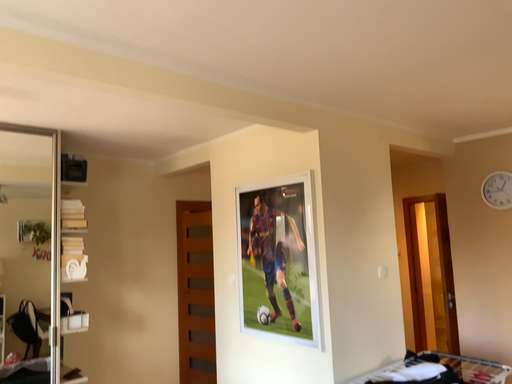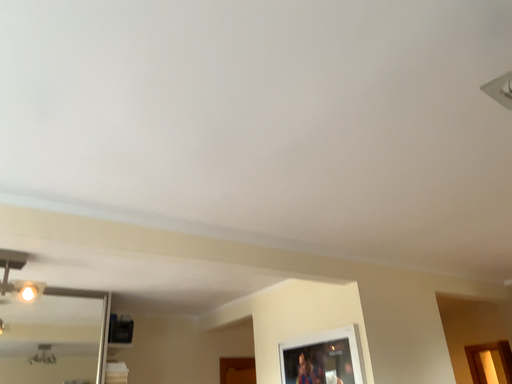
Question: Which way did the camera rotate in the video?

Choices:
 (A) rotated upward
 (B) rotated downward

Answer: (A)